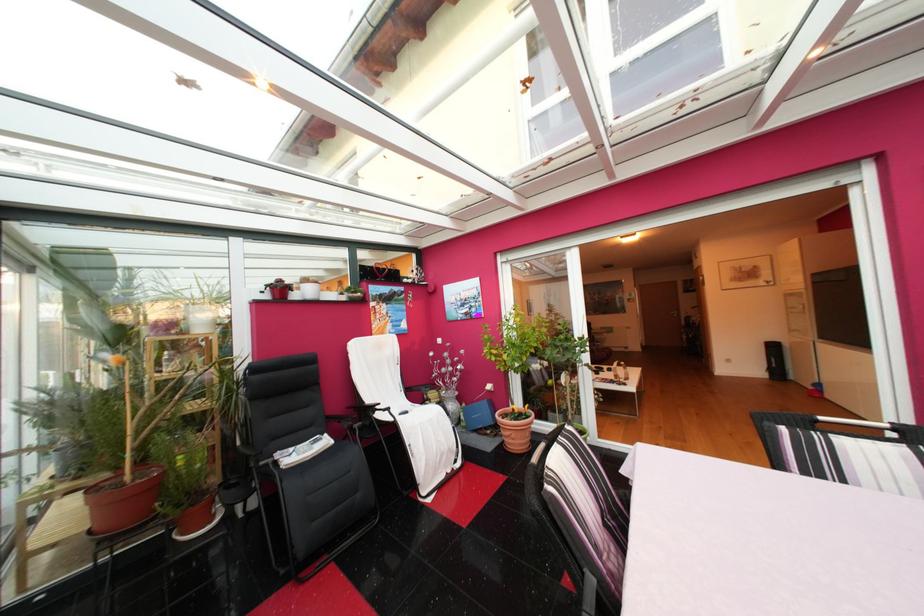
Find the location of `striped chair armrest`. striped chair armrest is located at coordinates (565, 464).